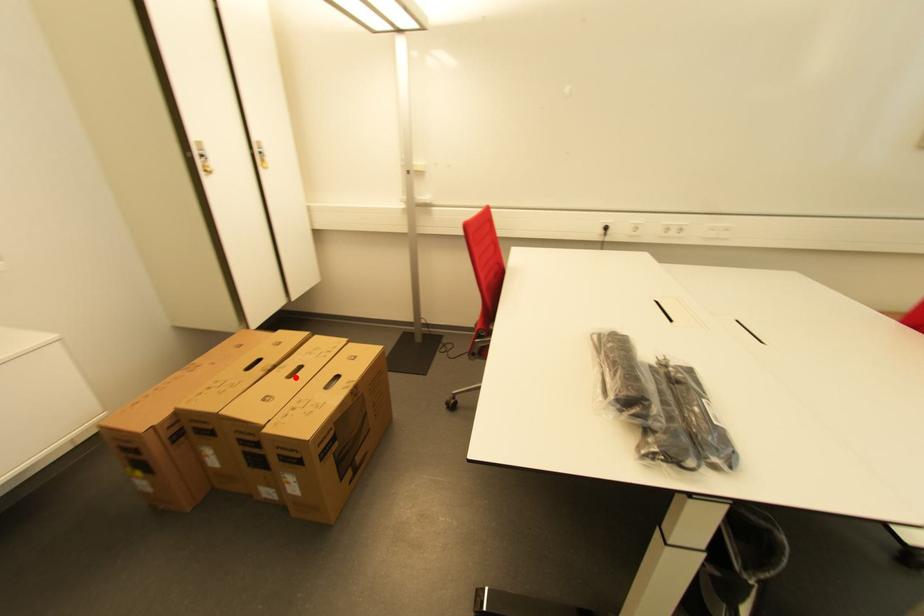
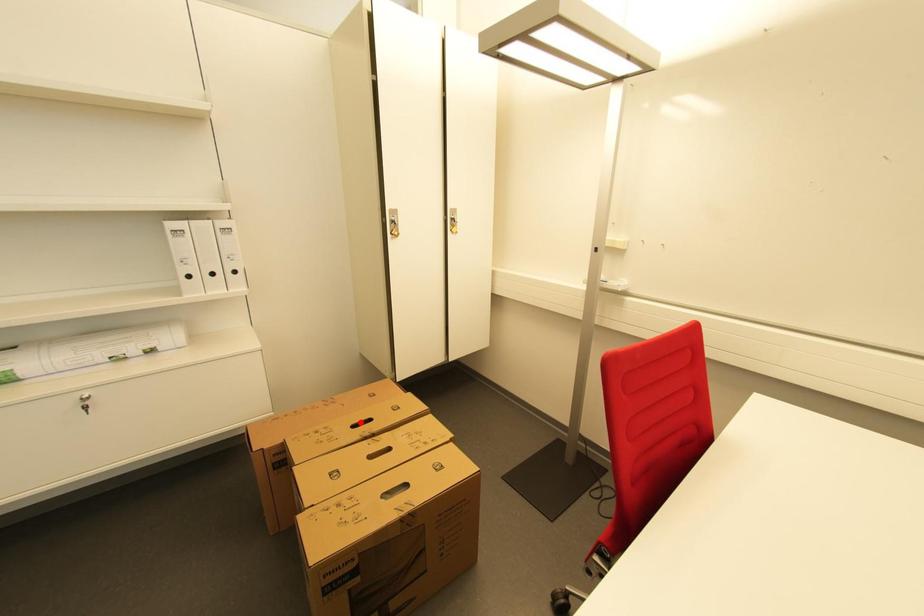
I am providing you with two images of the same scene from different viewpoints. A red point is marked on the first image and another point is marked on the second image. Do the highlighted points in image1 and image2 indicate the same real-world spot?

No